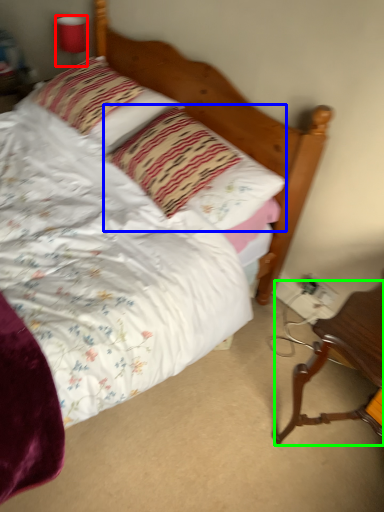
Question: Which object is the farthest from lamp (highlighted by a red box)? Choose among these: pillow (highlighted by a blue box) or desk (highlighted by a green box).

Choices:
 (A) pillow
 (B) desk

Answer: (B)